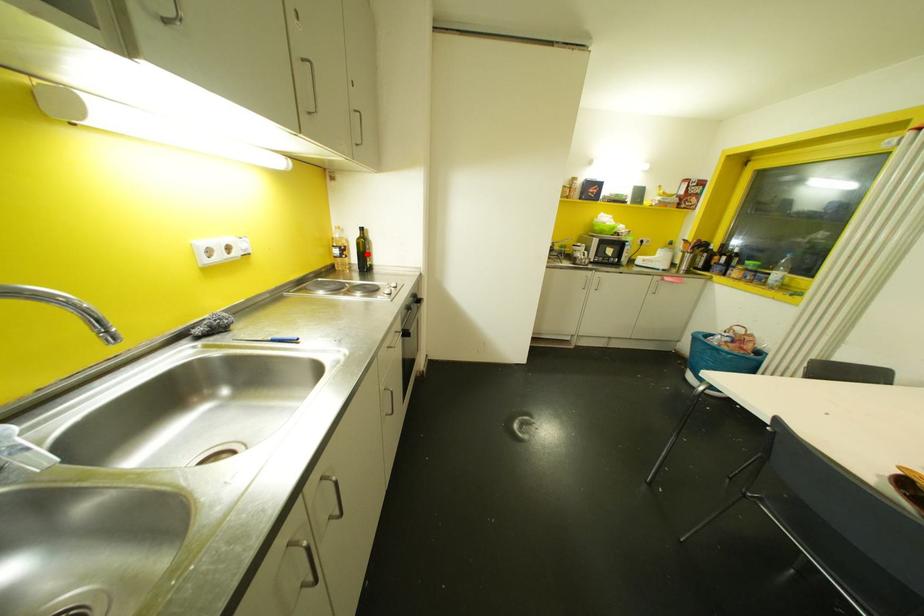
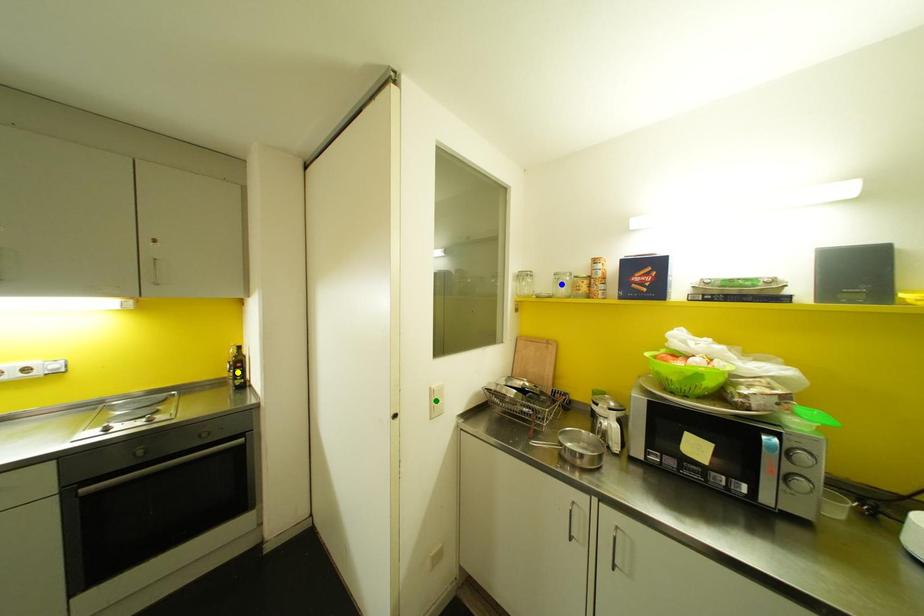
Question: I am providing you with two images of the same scene from different viewpoints. A red point is marked on the first image. You are given multiple points on the second image. In image 2, which mark is for the same physical point as the one in image 1?

Choices:
 (A) green point
 (B) yellow point
 (C) blue point

Answer: (B)